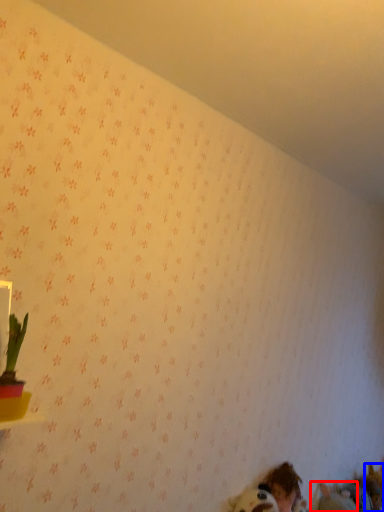
Question: Which object appears farthest to the camera in this image, animal (highlighted by a red box) or animal (highlighted by a blue box)?

Choices:
 (A) animal
 (B) animal

Answer: (B)